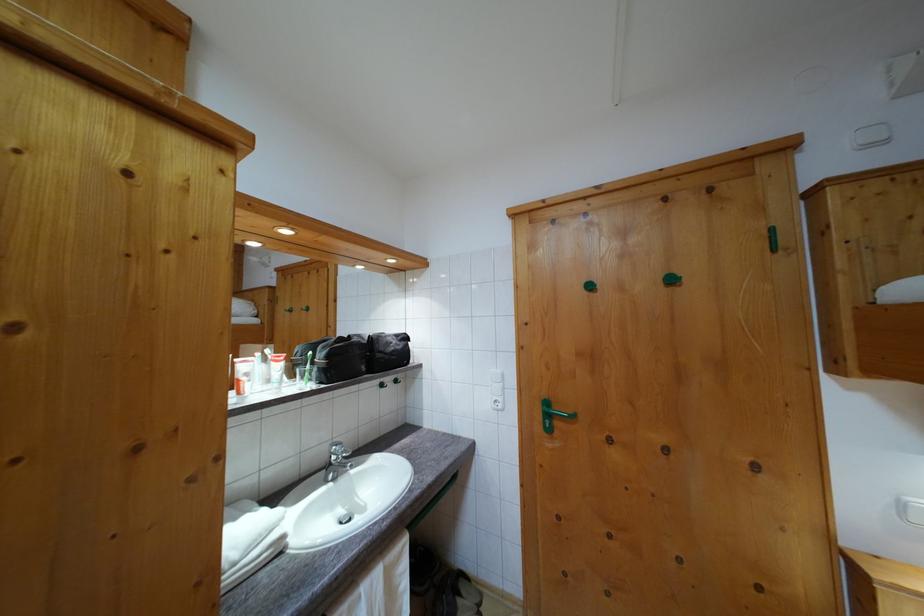
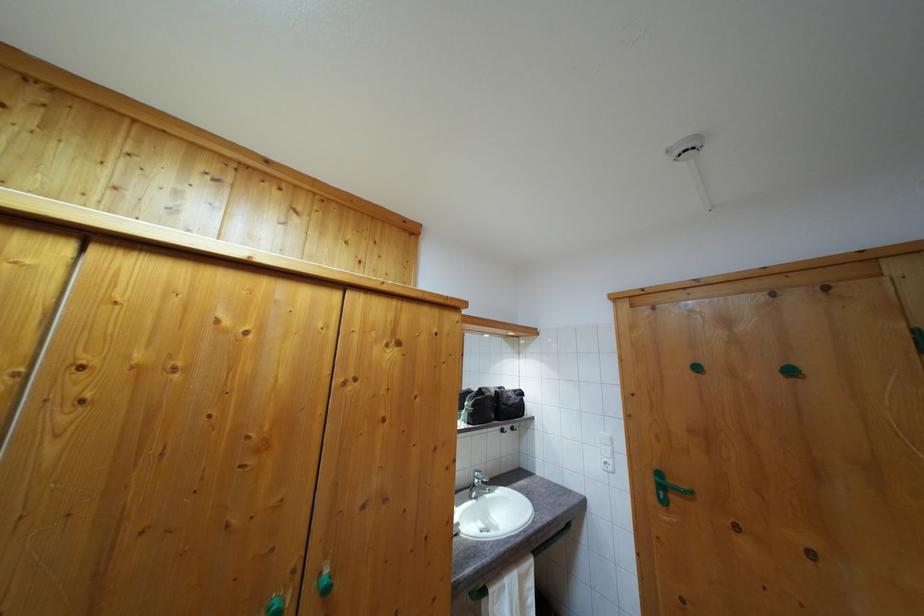
Find the pixel in the second image that matches pixel 504 392 in the first image.

(613, 456)